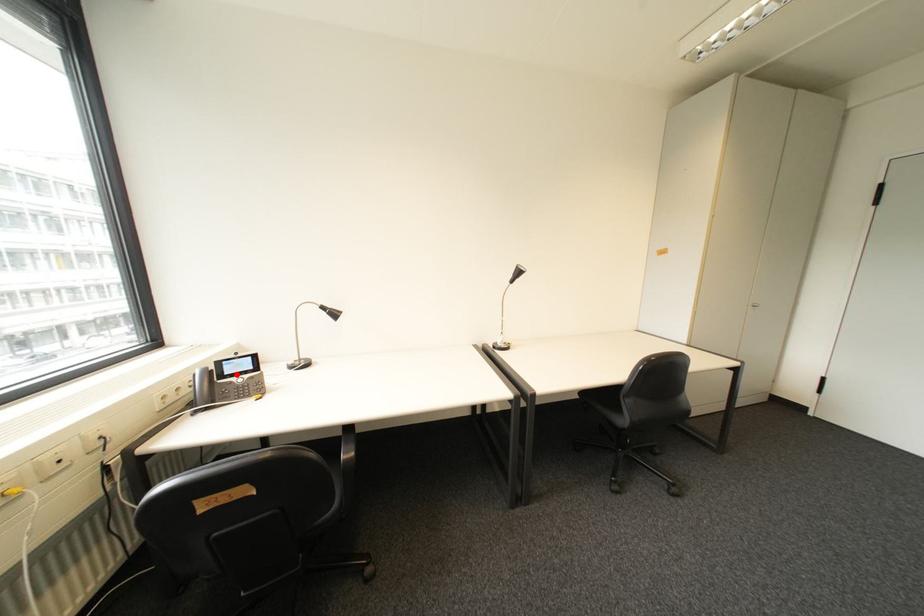
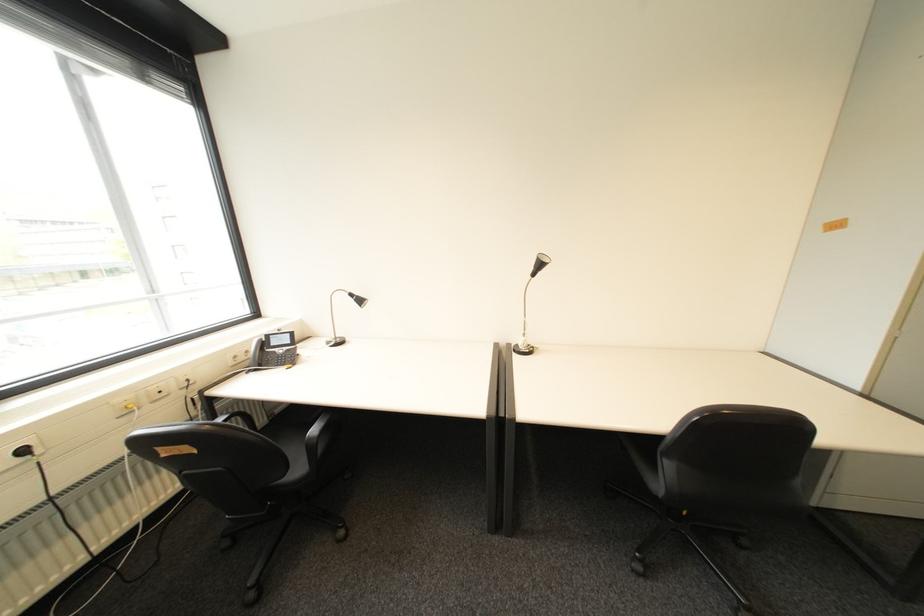
Question: I am providing you with two images of the same scene from different viewpoints. Given a red point in image1, look at the same physical point in image2. Is it:

Choices:
 (A) Closer to the viewpoint
 (B) Farther from the viewpoint

Answer: (A)